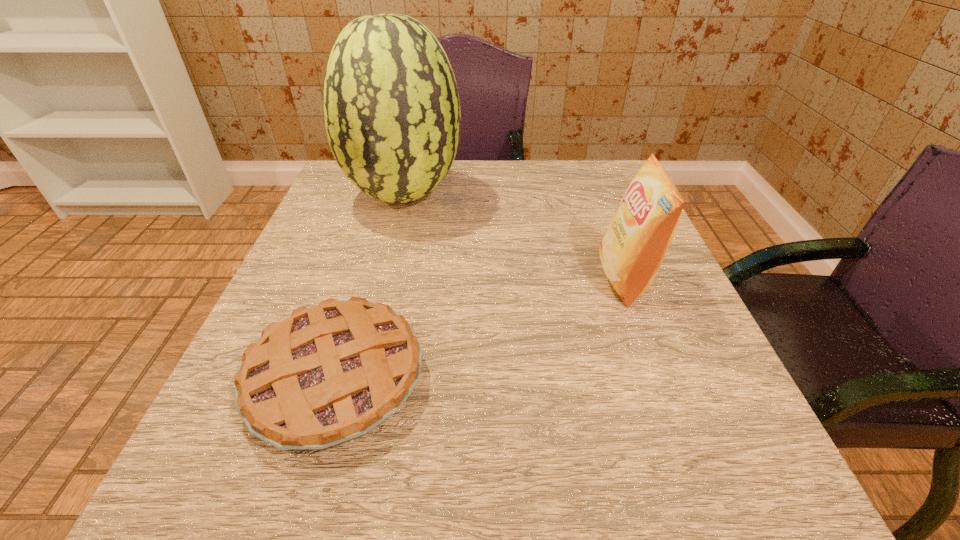
Find the location of a particular element. The image size is (960, 540). vacant space located on the right of the pie is located at coordinates (626, 379).

The image size is (960, 540). In order to click on object that is at the far edge in this screenshot , I will do point(392,114).

Locate an element on the screen. The height and width of the screenshot is (540, 960). object that is at the near edge is located at coordinates (328, 374).

Find the location of a particular element. The image size is (960, 540). watermelon that is at the left edge is located at coordinates (392, 114).

Locate an element on the screen. The image size is (960, 540). pie situated at the left edge is located at coordinates (328, 374).

Where is `object that is at the right edge`? The height and width of the screenshot is (540, 960). object that is at the right edge is located at coordinates (632, 249).

Identify the location of object located in the far left corner section of the desktop. (392, 114).

Find the location of a particular element. This screenshot has height=540, width=960. object that is at the near left corner is located at coordinates (328, 374).

I want to click on free space at the far edge of the desktop, so click(458, 196).

I want to click on free space at the near edge of the desktop, so click(554, 498).